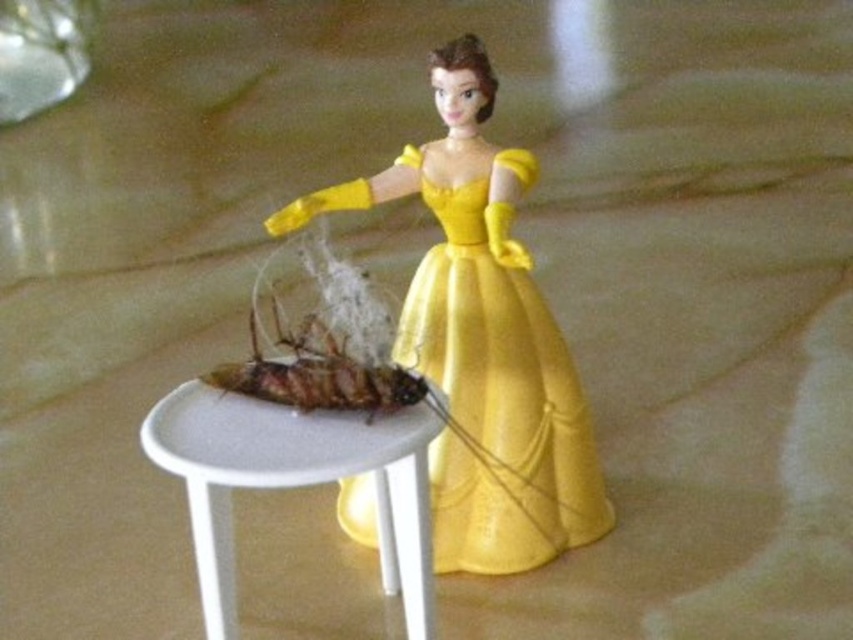
Is yellow satin dress at center to the right of white plastic table at center from the viewer's perspective?

Correct, you'll find yellow satin dress at center to the right of white plastic table at center.

Between yellow satin dress at center and white plastic table at center, which one has less height?

white plastic table at center

Is point (422, 275) farther from camera compared to point (386, 536)?

Yes, it is.

Where is `yellow satin dress at center`? This screenshot has height=640, width=853. yellow satin dress at center is located at coordinates (496, 387).